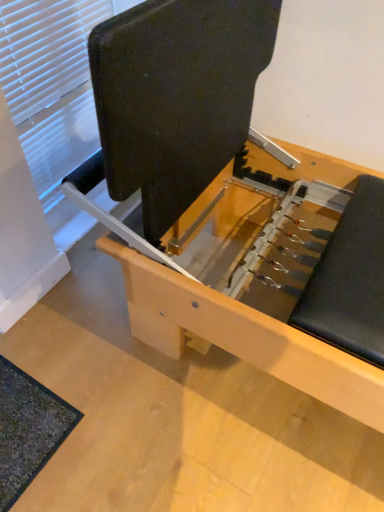
The image size is (384, 512). I want to click on free location to the right of dark green textured mat at lower left, so click(112, 425).